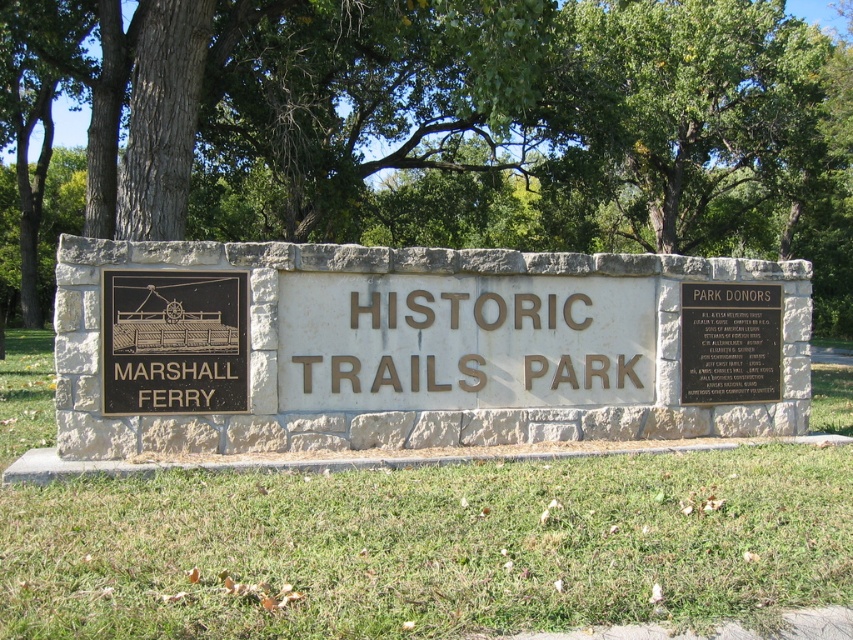
Is the position of black polished metal plaque at center more distant than that of black polished metal plaque at upper right?

No, it is not.

Who is more forward, (x=165, y=360) or (x=726, y=324)?

Point (x=165, y=360) is in front.

Locate an element on the screen. Image resolution: width=853 pixels, height=640 pixels. black polished metal plaque at center is located at coordinates (173, 340).

Locate an element on the screen. Image resolution: width=853 pixels, height=640 pixels. black polished metal plaque at center is located at coordinates (173, 340).

Is gold metallic sign at center thinner than black polished metal plaque at upper right?

In fact, gold metallic sign at center might be wider than black polished metal plaque at upper right.

Who is shorter, gold metallic sign at center or black polished metal plaque at upper right?

With less height is gold metallic sign at center.

Find the location of a particular element. The image size is (853, 640). gold metallic sign at center is located at coordinates (462, 340).

In the scene shown: Is gold metallic sign at center smaller than black polished metal plaque at center?

Incorrect, gold metallic sign at center is not smaller in size than black polished metal plaque at center.

The width and height of the screenshot is (853, 640). Identify the location of gold metallic sign at center. click(462, 340).

Which is behind, point (355, 317) or point (148, 332)?

Point (355, 317)

Identify the location of gold metallic sign at center. (462, 340).